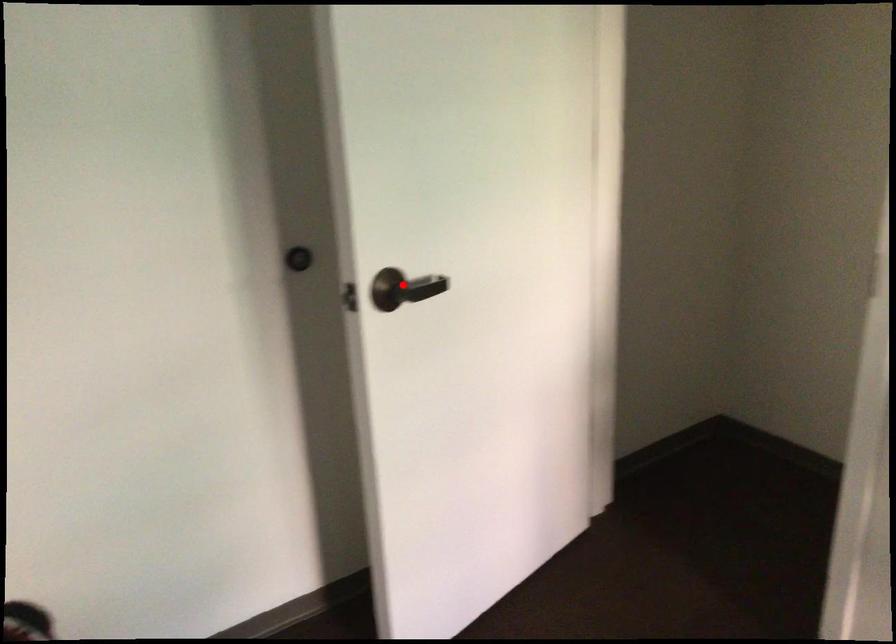
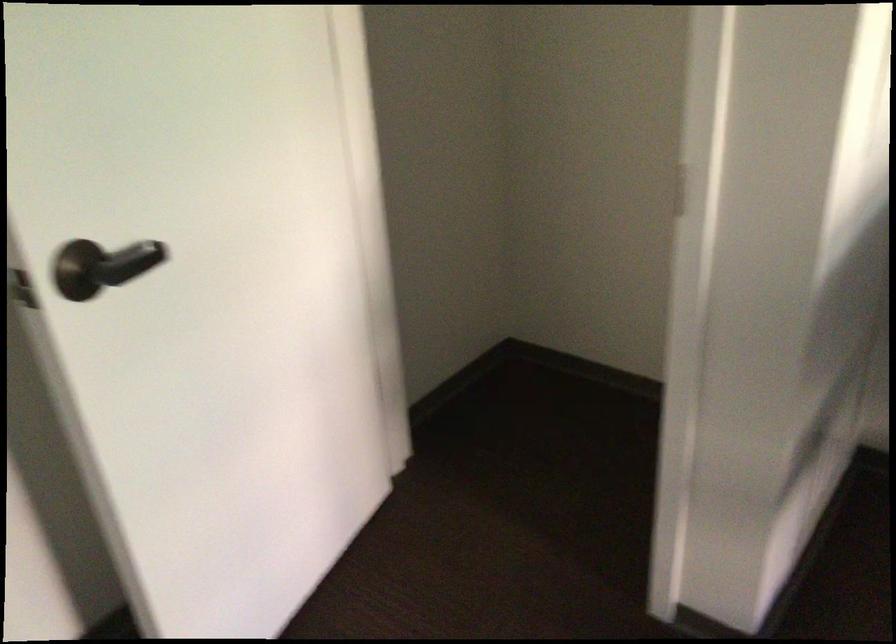
In the second image, find the point that corresponds to the highlighted location in the first image.

(107, 265)